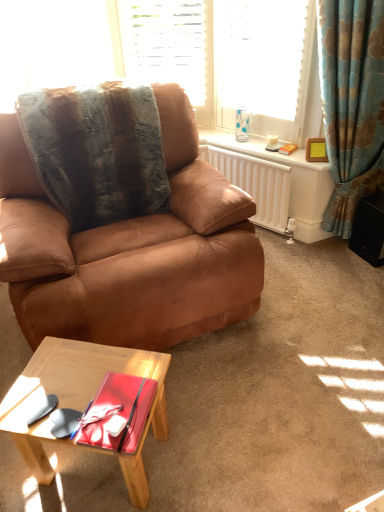
Question: From the image's perspective, is light wood coffee table at lower left on white textured blinds at upper center, acting as the 1th window starting from the left?

Choices:
 (A) yes
 (B) no

Answer: (B)

Question: Considering the relative sizes of light wood coffee table at lower left and white textured blinds at upper center, which is the second window from right to left, in the image provided, is light wood coffee table at lower left thinner than white textured blinds at upper center, which is the second window from right to left,?

Choices:
 (A) no
 (B) yes

Answer: (A)

Question: From a real-world perspective, is light wood coffee table at lower left positioned over white textured blinds at upper center, which is the second window from right to left, based on gravity?

Choices:
 (A) no
 (B) yes

Answer: (A)

Question: Is light wood coffee table at lower left completely or partially outside of white textured blinds at upper center, acting as the 1th window starting from the left?

Choices:
 (A) yes
 (B) no

Answer: (A)

Question: Does light wood coffee table at lower left have a smaller size compared to white textured blinds at upper center, which is the second window from right to left?

Choices:
 (A) yes
 (B) no

Answer: (A)

Question: Is light wood coffee table at lower left further to the viewer compared to white textured blinds at upper center, acting as the 1th window starting from the left?

Choices:
 (A) yes
 (B) no

Answer: (B)

Question: Is blue floral fabric curtain at right at the right side of translucent glass coffee cup at upper right?

Choices:
 (A) yes
 (B) no

Answer: (A)

Question: Does blue floral fabric curtain at right contain translucent glass coffee cup at upper right?

Choices:
 (A) no
 (B) yes

Answer: (A)

Question: Is blue floral fabric curtain at right behind translucent glass coffee cup at upper right?

Choices:
 (A) yes
 (B) no

Answer: (B)

Question: From a real-world perspective, is blue floral fabric curtain at right physically below translucent glass coffee cup at upper right?

Choices:
 (A) no
 (B) yes

Answer: (A)

Question: Is blue floral fabric curtain at right touching translucent glass coffee cup at upper right?

Choices:
 (A) yes
 (B) no

Answer: (B)

Question: Can you confirm if blue floral fabric curtain at right is taller than translucent glass coffee cup at upper right?

Choices:
 (A) no
 (B) yes

Answer: (B)

Question: Can you see light wood coffee table at lower left touching fuzzy brown blanket at upper left?

Choices:
 (A) yes
 (B) no

Answer: (B)